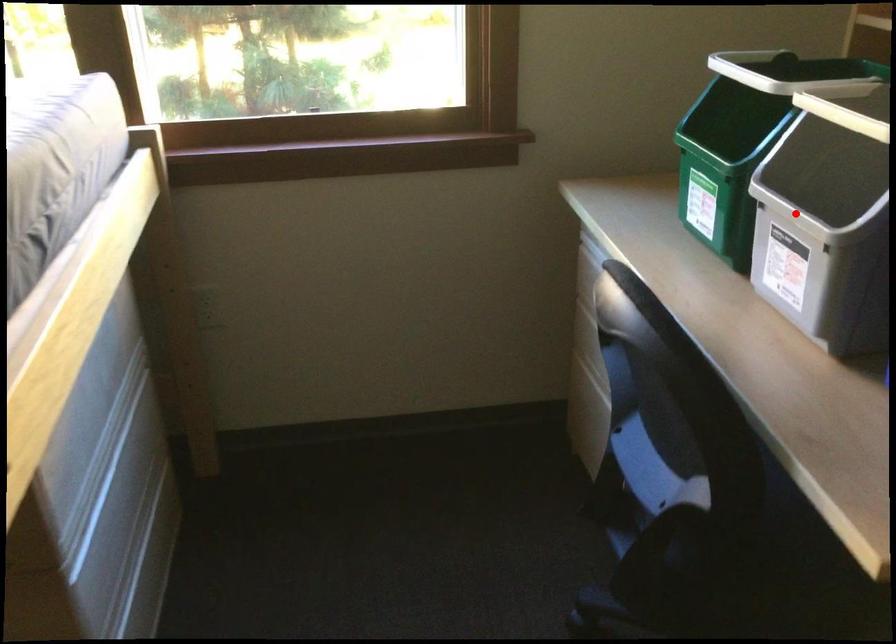
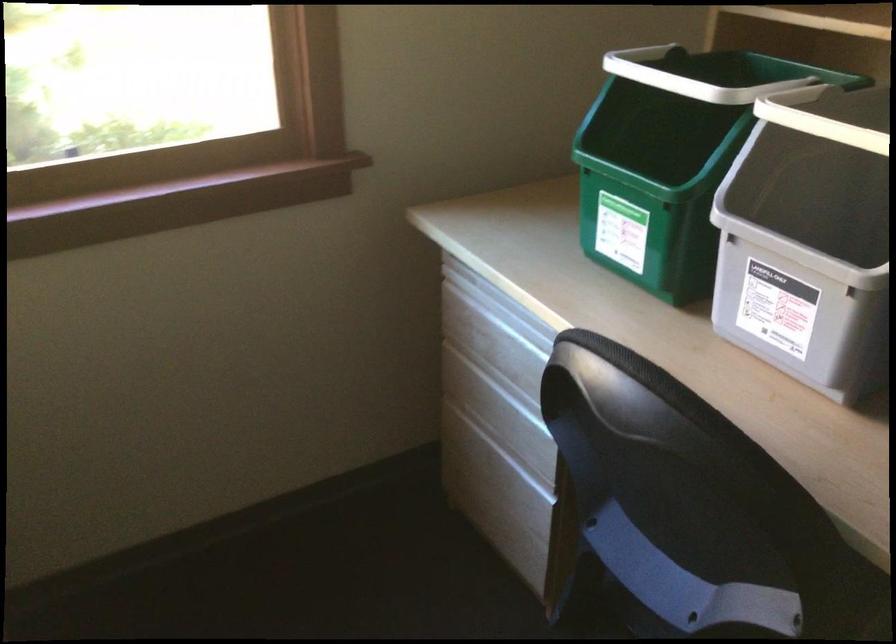
Find the pixel in the second image that matches the highlighted location in the first image.

(797, 250)